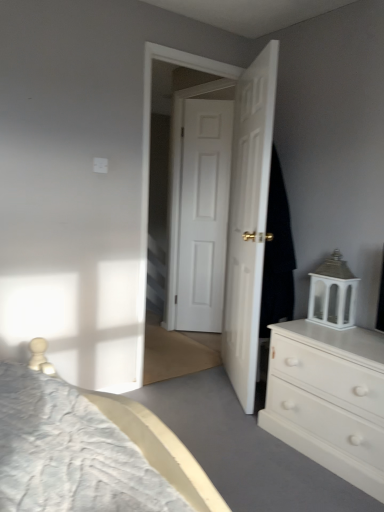
What do you see at coordinates (203, 214) in the screenshot?
I see `white matte door at center, marked as the 2th door in a front-to-back arrangement` at bounding box center [203, 214].

Measure the distance between point (254, 143) and camera.

2.47 meters.

The width and height of the screenshot is (384, 512). What are the coordinates of `black fabric at right` in the screenshot? It's located at (277, 255).

Does point (276, 179) lie behind point (188, 157)?

No, it is in front of (188, 157).

Is black fabric at right wider than white matte door at center, marked as the 2th door in a front-to-back arrangement?

Yes.

Is black fabric at right turned away from white matte door at center, placed as the 1th door when sorted from back to front?

That's not correct — black fabric at right is not looking away from white matte door at center, placed as the 1th door when sorted from back to front.

Could you tell me if white glossy door at center, positioned as the first door in front-to-back order, is facing white wooden door at center?

Yes, white glossy door at center, positioned as the first door in front-to-back order, faces towards white wooden door at center.

Locate an element on the screen. door that is the 2nd object to the right of the white wooden door at center, starting at the anchor is located at coordinates (248, 221).

Which object is positioned more to the right, white glossy door at center, positioned as the first door in front-to-back order, or white wooden door at center?

From the viewer's perspective, white glossy door at center, positioned as the first door in front-to-back order, appears more on the right side.

From the image's perspective, between black fabric at right and white wooden door at center, which one is located above?

From the image's view, white wooden door at center is above.

From a real-world perspective, between black fabric at right and white wooden door at center, who is vertically lower?

In real-world perspective, white wooden door at center is lower.

Could you tell me if black fabric at right is facing white wooden door at center?

No.

Which of these two, white matte door at center, placed as the 1th door when sorted from back to front, or black fabric at right, stands shorter?

black fabric at right.

What's the angular difference between white matte door at center, placed as the 1th door when sorted from back to front, and black fabric at right's facing directions?

The angular difference between white matte door at center, placed as the 1th door when sorted from back to front, and black fabric at right is 5.48 degrees.

Consider the image. Based on their positions, is white matte door at center, placed as the 1th door when sorted from back to front, located to the left or right of black fabric at right?

From the image, it's evident that white matte door at center, placed as the 1th door when sorted from back to front, is to the left of black fabric at right.

From a real-world perspective, between white matte door at center, placed as the 1th door when sorted from back to front, and black fabric at right, who is vertically higher?

black fabric at right.

From a real-world perspective, between white matte chest of drawers at right and white glossy door at center, positioned as the first door in front-to-back order, who is vertically higher?

In real-world perspective, white glossy door at center, positioned as the first door in front-to-back order, is above.

Which object is positioned more to the right, white matte chest of drawers at right or white glossy door at center, placed as the 2th door when sorted from back to front?

Positioned to the right is white matte chest of drawers at right.

Would you consider white matte chest of drawers at right to be distant from white glossy door at center, positioned as the first door in front-to-back order?

No, there isn't a large distance between white matte chest of drawers at right and white glossy door at center, positioned as the first door in front-to-back order.

Which is farther, (307,441) or (251,392)?

Point (251,392)

Looking at this image, from the image's perspective, which object appears higher, white wooden door at center or white matte door at center, marked as the 2th door in a front-to-back arrangement?

white matte door at center, marked as the 2th door in a front-to-back arrangement.

Considering the positions of points (258, 180) and (229, 170), is point (258, 180) farther from camera compared to point (229, 170)?

No, it is in front of (229, 170).

Looking at this image, how many degrees apart are the facing directions of white wooden door at center and white matte door at center, placed as the 1th door when sorted from back to front?

39.7 degrees separate the facing orientations of white wooden door at center and white matte door at center, placed as the 1th door when sorted from back to front.

Does white glossy door at center, placed as the 2th door when sorted from back to front, contain black fabric at right?

Definitely not — black fabric at right is not inside white glossy door at center, placed as the 2th door when sorted from back to front.

Can you confirm if white glossy door at center, positioned as the first door in front-to-back order, is bigger than black fabric at right?

Indeed, white glossy door at center, positioned as the first door in front-to-back order, has a larger size compared to black fabric at right.

From a real-world perspective, relative to black fabric at right, is white glossy door at center, positioned as the first door in front-to-back order, vertically above or below?

white glossy door at center, positioned as the first door in front-to-back order, is below black fabric at right.

Is the position of white glossy door at center, positioned as the first door in front-to-back order, less distant than that of black fabric at right?

Yes, it is.

The height and width of the screenshot is (512, 384). What are the coordinates of `door lying behind the black fabric at right` in the screenshot? It's located at (203, 214).

I want to click on screen door that appears above the white glossy door at center, positioned as the first door in front-to-back order (from the image's perspective), so click(x=235, y=200).

Looking at the image, which one is located further to white glossy door at center, placed as the 2th door when sorted from back to front, black fabric at right or white wooden door at center?

Based on the image, black fabric at right appears to be further to white glossy door at center, placed as the 2th door when sorted from back to front.

Based on their spatial positions, is white matte chest of drawers at right or black fabric at right closer to white glossy door at center, positioned as the first door in front-to-back order?

Based on the image, black fabric at right appears to be nearer to white glossy door at center, positioned as the first door in front-to-back order.

Considering their positions, is white matte door at center, marked as the 2th door in a front-to-back arrangement, positioned closer to white wooden door at center than white glossy door at center, placed as the 2th door when sorted from back to front?

white glossy door at center, placed as the 2th door when sorted from back to front.

Considering their positions, is white matte chest of drawers at right positioned further to white glossy door at center, placed as the 2th door when sorted from back to front, than white wooden door at center?

white matte chest of drawers at right.

Considering their positions, is white glossy door at center, placed as the 2th door when sorted from back to front, positioned further to black fabric at right than white matte chest of drawers at right?

The object further to black fabric at right is white matte chest of drawers at right.

Based on their spatial positions, is white matte chest of drawers at right or white matte door at center, placed as the 1th door when sorted from back to front, closer to black fabric at right?

Based on the image, white matte chest of drawers at right appears to be nearer to black fabric at right.

When comparing their distances from white glossy door at center, positioned as the first door in front-to-back order, does white matte door at center, marked as the 2th door in a front-to-back arrangement, or black fabric at right seem closer?

black fabric at right is positioned closer to the anchor white glossy door at center, positioned as the first door in front-to-back order.

When comparing their distances from white matte chest of drawers at right, does black fabric at right or white matte door at center, marked as the 2th door in a front-to-back arrangement, seem further?

Based on the image, white matte door at center, marked as the 2th door in a front-to-back arrangement, appears to be further to white matte chest of drawers at right.

Identify the location of dark between white glossy door at center, placed as the 2th door when sorted from back to front, and white matte door at center, placed as the 1th door when sorted from back to front, in the front-back direction. (277, 255).

Identify the location of dark between white matte chest of drawers at right and white matte door at center, marked as the 2th door in a front-to-back arrangement, along the z-axis. (277, 255).

The image size is (384, 512). In order to click on door between black fabric at right and white matte chest of drawers at right from top to bottom in this screenshot , I will do `click(248, 221)`.

This screenshot has width=384, height=512. Identify the location of screen door between white matte chest of drawers at right and white matte door at center, placed as the 1th door when sorted from back to front, from front to back. (235, 200).